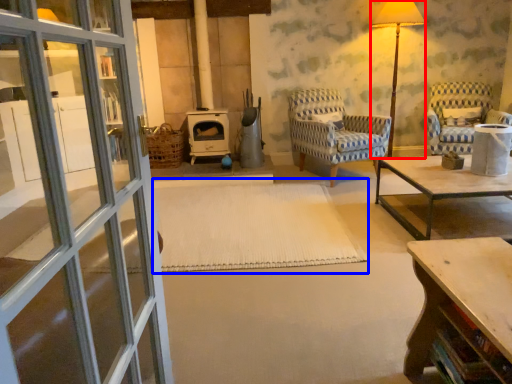
Question: Among these objects, which one is nearest to the camera, table lamp (highlighted by a red box) or mat (highlighted by a blue box)?

Choices:
 (A) table lamp
 (B) mat

Answer: (B)